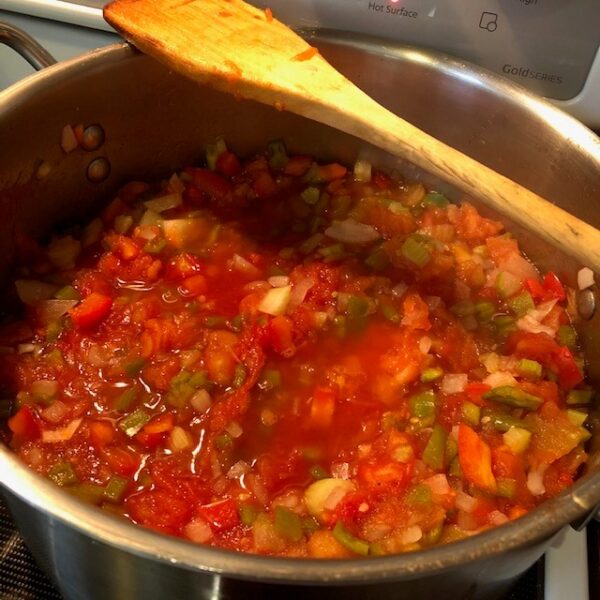
At what (x,y) coordinates should I click in order to perform the action: click on stovetop. Please return your answer as a coordinate pair (x, y). The image size is (600, 600). Looking at the image, I should click on (567, 562), (63, 564).